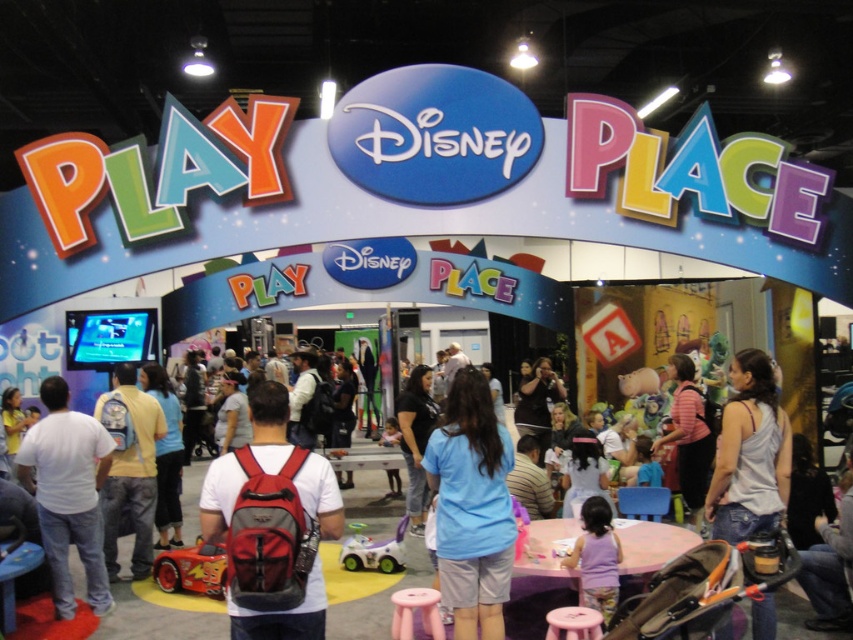
This screenshot has width=853, height=640. What are the coordinates of `light blue shirt at center` in the screenshot? It's located at (416, 438).

Which is in front, point (416, 518) or point (172, 552)?

Point (172, 552) is in front.

Identify the location of light blue shirt at center. This screenshot has width=853, height=640. (416, 438).

Does denim jacket at center come in front of shiny red plastic car at center?

No, denim jacket at center is behind shiny red plastic car at center.

Who is lower down, denim jacket at center or shiny red plastic car at center?

shiny red plastic car at center

Between point (141, 451) and point (164, 582), which one is positioned behind?

Positioned behind is point (141, 451).

The height and width of the screenshot is (640, 853). I want to click on denim jacket at center, so click(x=132, y=477).

Can you confirm if blue cotton shirt at center is positioned above striped shirt at center?

Yes.

From the picture: Can you confirm if blue cotton shirt at center is taller than striped shirt at center?

In fact, blue cotton shirt at center may be shorter than striped shirt at center.

At what (x,y) coordinates should I click in order to perform the action: click on blue cotton shirt at center. Please return your answer as a coordinate pair (x, y). The width and height of the screenshot is (853, 640). Looking at the image, I should click on (473, 508).